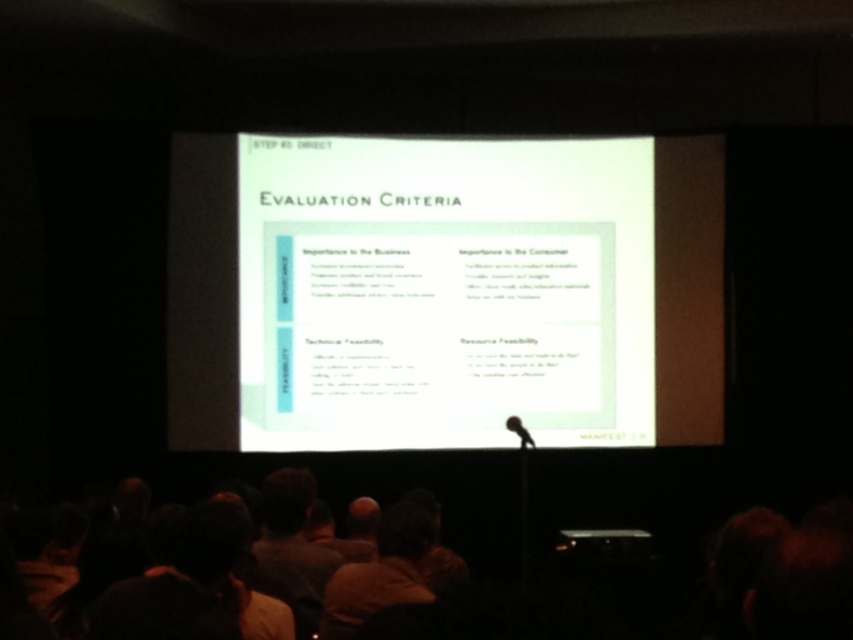
You are an attendee at the presentation and want to ask a question. You see the brown hair at lower center and the black matte microphone at center. Which object is closer to your left side?

The brown hair at lower center is to the left of the black matte microphone at center, so the brown hair at lower center is closer to your left side.

You are a speaker preparing to present your slides. You notice two items in the room that might block the projector beam. The items are the white paper at center and the brown hair at lower center. Which item is more likely to block the projector beam based on their sizes?

The white paper at center is much taller than the brown hair at lower center, so it is more likely to block the projector beam.

You are a speaker at the conference and need to place a white paper at center and a black matte microphone at center on the table in front of you. Since the table is only 1 meter wide, will both items fit side by side without overlapping?

The white paper at center has a larger width than the black matte microphone at center. However, since the exact widths are not provided, we cannot determine if both will fit side by side on a 1 meter wide table. Please provide more details about their individual widths.